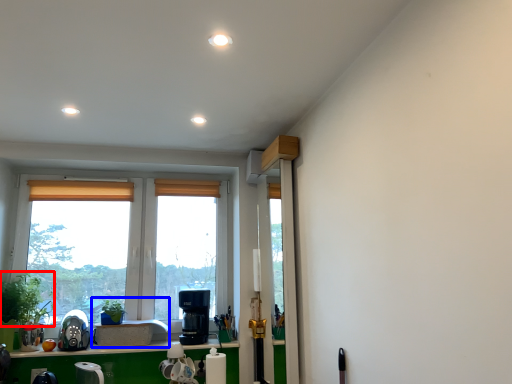
Question: Which point is further to the camera, plant (highlighted by a red box) or sink (highlighted by a blue box)?

Choices:
 (A) plant
 (B) sink

Answer: (B)